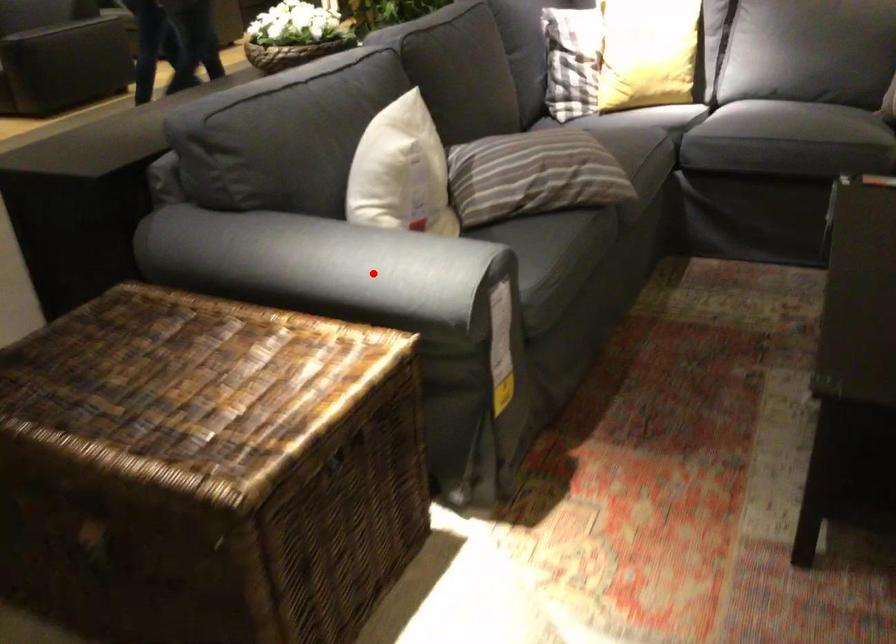
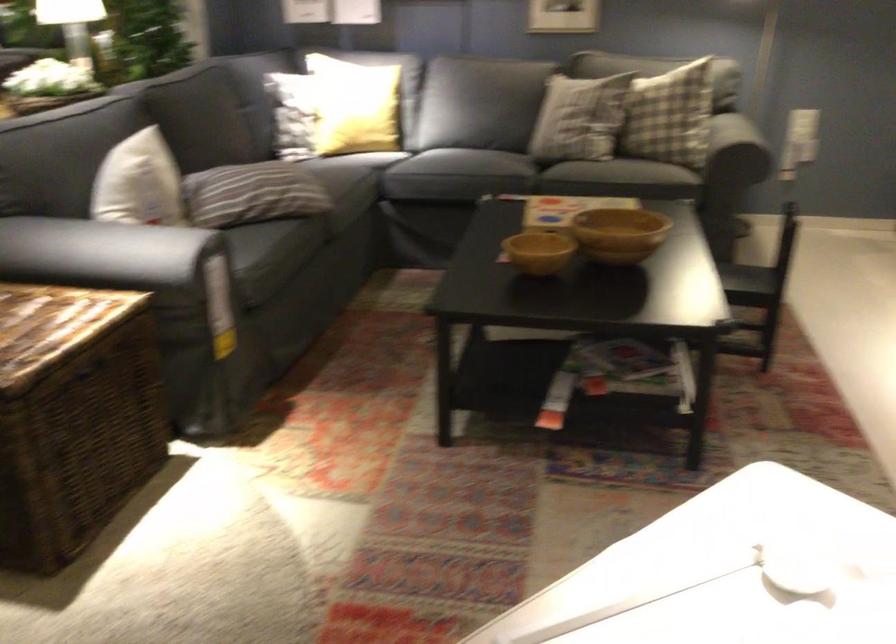
Question: I am providing you with two images of the same scene from different viewpoints. A red point is shown in image1. For the corresponding object point in image2, is it positioned nearer or farther from the camera?

Choices:
 (A) Nearer
 (B) Farther

Answer: (B)